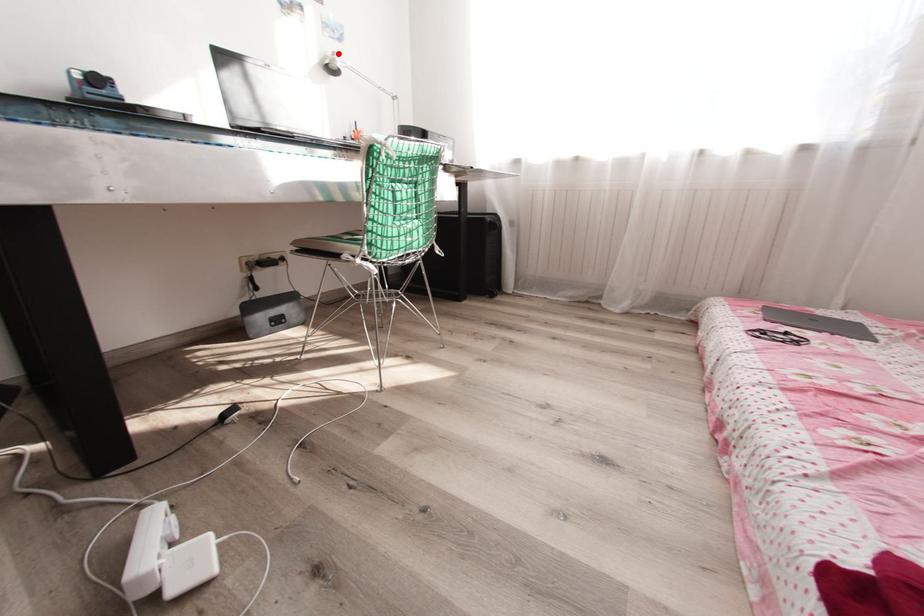
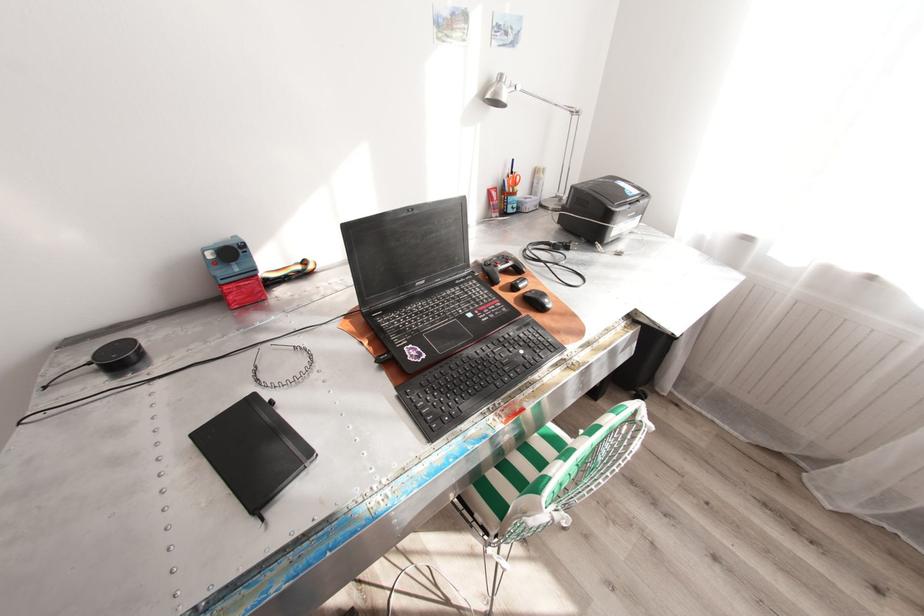
Locate, in the second image, the point that corresponds to the highlighted location in the first image.

(505, 76)